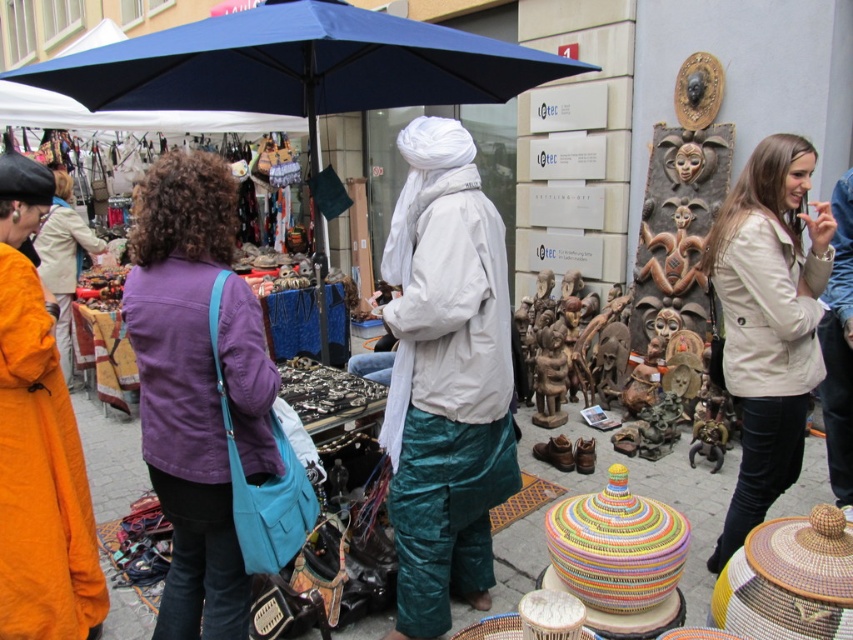
Is purple cotton jacket at center wider than purple fabric bag at upper left?

Indeed, purple cotton jacket at center has a greater width compared to purple fabric bag at upper left.

Based on the photo, who is positioned more to the right, purple cotton jacket at center or purple fabric bag at upper left?

Positioned to the right is purple cotton jacket at center.

Where is `purple cotton jacket at center`? This screenshot has width=853, height=640. purple cotton jacket at center is located at coordinates (186, 388).

Between blue fabric umbrella at center and beige leather jacket at upper right, which one appears on the left side from the viewer's perspective?

From the viewer's perspective, blue fabric umbrella at center appears more on the left side.

Does blue fabric umbrella at center come behind beige leather jacket at upper right?

No, blue fabric umbrella at center is in front of beige leather jacket at upper right.

Is point (489, 74) farther from camera compared to point (722, 260)?

Yes, it is.

I want to click on blue fabric umbrella at center, so click(297, 65).

Is white satin turban at center wider than beige leather jacket at upper right?

Yes, white satin turban at center is wider than beige leather jacket at upper right.

Does white satin turban at center come in front of beige leather jacket at upper right?

Yes, white satin turban at center is in front of beige leather jacket at upper right.

The width and height of the screenshot is (853, 640). Find the location of `white satin turban at center`. white satin turban at center is located at coordinates (445, 378).